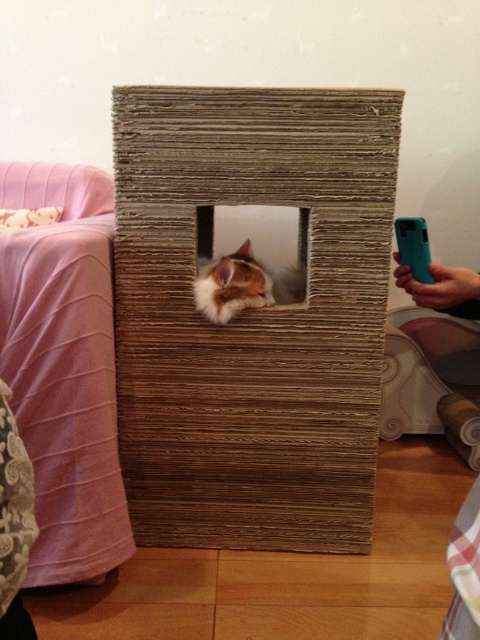
You are standing in the room and want to place a small plant pot that is 2 feet tall on the floor. The point where you want to place it is at coordinates point [239,120]. Given that the distance from the camera to this point is 3.87 feet, will the plant pot be visible from the camera position?

The distance of point [239,120] from camera is 3.87 feet. Since the plant pot is only 2 feet tall, it will not block the view of the point itself, but the visibility depends on the surrounding objects. However, based solely on the given distance, the plant pot placed at point [239,120] would be within the camera view as it is at that point.

Consider the image. You are a delivery robot trying to reach the teal plastic phone at lower right. There is a brown cardboard box at center in your path. Can you go around it without moving the box?

The brown cardboard box at center is further to the viewer than the teal plastic phone at lower right, so you can go around it by moving to the side of the box closer to the phone since the box is in front of the phone.